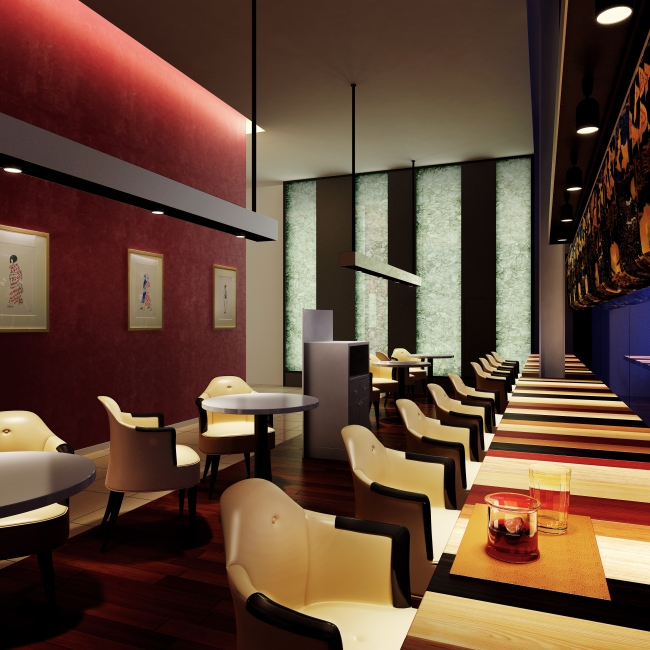
This screenshot has height=650, width=650. What are the coordinates of `placemat` in the screenshot? It's located at (551, 566).